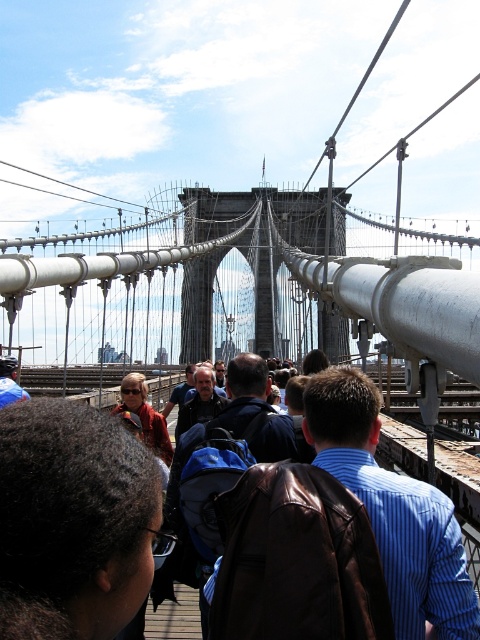
Which is more to the left, dark brown hair at center or brown leather jacket at center?

dark brown hair at center

Does point (97, 433) come in front of point (363, 385)?

Yes, it is.

Where is `dark brown hair at center`? dark brown hair at center is located at coordinates (72, 522).

How distant is dark brown hair at center from matte brown leather jacket at center?

dark brown hair at center is 59.42 meters from matte brown leather jacket at center.

You are a GUI agent. You are given a task and a screenshot of the screen. Output one action in this format:
    pyautogui.click(x=<x>, y=<y>)
    Task: Click on the dark brown hair at center
    The image size is (480, 640).
    Given the screenshot: What is the action you would take?
    pyautogui.click(x=72, y=522)

Is brown leather jacket at center to the left of matte brown leather jacket at center from the viewer's perspective?

In fact, brown leather jacket at center is to the right of matte brown leather jacket at center.

Which is in front, point (430, 620) or point (144, 426)?

Positioned in front is point (430, 620).

At what (x,y) coordinates should I click in order to perform the action: click on brown leather jacket at center. Please return your answer as a coordinate pair (x, y). The height and width of the screenshot is (640, 480). Looking at the image, I should click on (x=394, y=509).